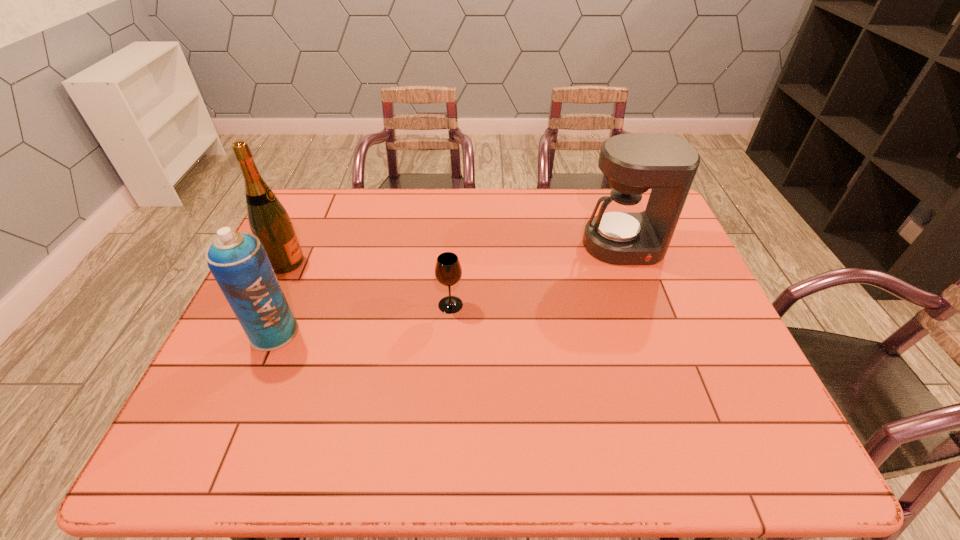
The height and width of the screenshot is (540, 960). Identify the location of the tallest object. (268, 219).

Where is `coffee maker`? coffee maker is located at coordinates (622, 233).

Identify the location of the nearest object. (238, 261).

Locate an element on the screen. wineglass is located at coordinates (448, 271).

Where is `the third object from left to right`? This screenshot has width=960, height=540. the third object from left to right is located at coordinates (448, 271).

Locate an element on the screen. The height and width of the screenshot is (540, 960). vacant space located 0.300m on the front-facing side of the tallest object is located at coordinates (405, 262).

At what (x,y) coordinates should I click in order to perform the action: click on vacant space situated 0.150m on the button side of the coffee maker. Please return your answer as a coordinate pair (x, y). This screenshot has height=540, width=960. Looking at the image, I should click on (644, 305).

Identify the location of free space located on the back of the aerosol can. This screenshot has height=540, width=960. (301, 268).

Locate an element on the screen. This screenshot has height=540, width=960. vacant space located 0.400m on the back of the wineglass is located at coordinates (457, 210).

Identify the location of object situated at the far edge. The image size is (960, 540). (x=622, y=233).